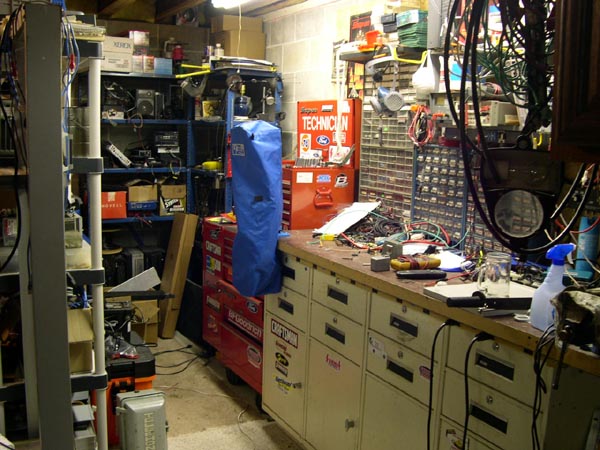
I want to click on stacks of plastic containers to hold small items, so click(x=384, y=162), click(x=444, y=195), click(x=484, y=242).